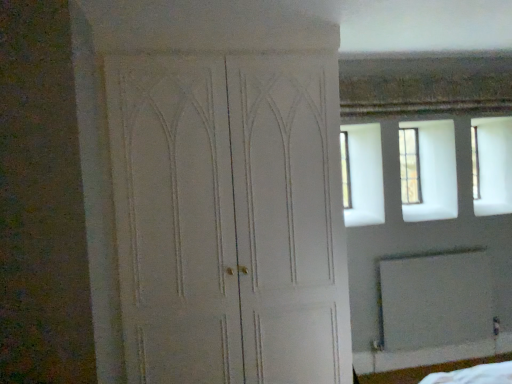
Question: From a real-world perspective, is clear glass window at upper right physically above white matte door at center?

Choices:
 (A) no
 (B) yes

Answer: (B)

Question: Is clear glass window at upper right in front of white matte door at center?

Choices:
 (A) yes
 (B) no

Answer: (B)

Question: Is clear glass window at upper right oriented towards white matte door at center?

Choices:
 (A) no
 (B) yes

Answer: (A)

Question: From a real-world perspective, is clear glass window at upper right positioned under white matte door at center based on gravity?

Choices:
 (A) yes
 (B) no

Answer: (B)

Question: Does clear glass window at upper right have a greater height compared to white matte door at center?

Choices:
 (A) yes
 (B) no

Answer: (B)

Question: Considering the relative sizes of clear glass window at upper right and white matte door at center in the image provided, is clear glass window at upper right shorter than white matte door at center?

Choices:
 (A) yes
 (B) no

Answer: (A)

Question: Is white matte door at center further to camera compared to white matte screen door at lower right?

Choices:
 (A) yes
 (B) no

Answer: (B)

Question: Is white matte screen door at lower right at the back of white matte door at center?

Choices:
 (A) no
 (B) yes

Answer: (A)

Question: Is white matte door at center in front of white matte screen door at lower right?

Choices:
 (A) yes
 (B) no

Answer: (A)

Question: Is white matte door at center at the left side of white matte screen door at lower right?

Choices:
 (A) yes
 (B) no

Answer: (A)

Question: Does white matte door at center have a lesser width compared to white matte screen door at lower right?

Choices:
 (A) no
 (B) yes

Answer: (A)

Question: Does white matte door at center have a larger size compared to white matte screen door at lower right?

Choices:
 (A) yes
 (B) no

Answer: (A)

Question: Is white matte screen door at lower right looking in the opposite direction of clear glass window at upper right?

Choices:
 (A) yes
 (B) no

Answer: (B)